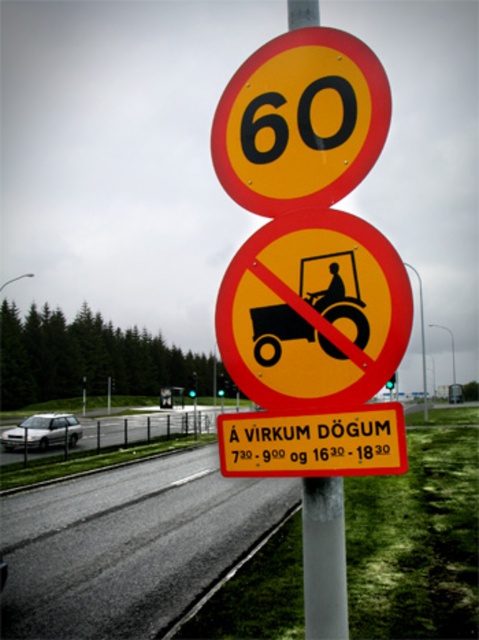
What is the color of the sign located at point (300,122)?

The sign located at point (300,122) is yellow matte.